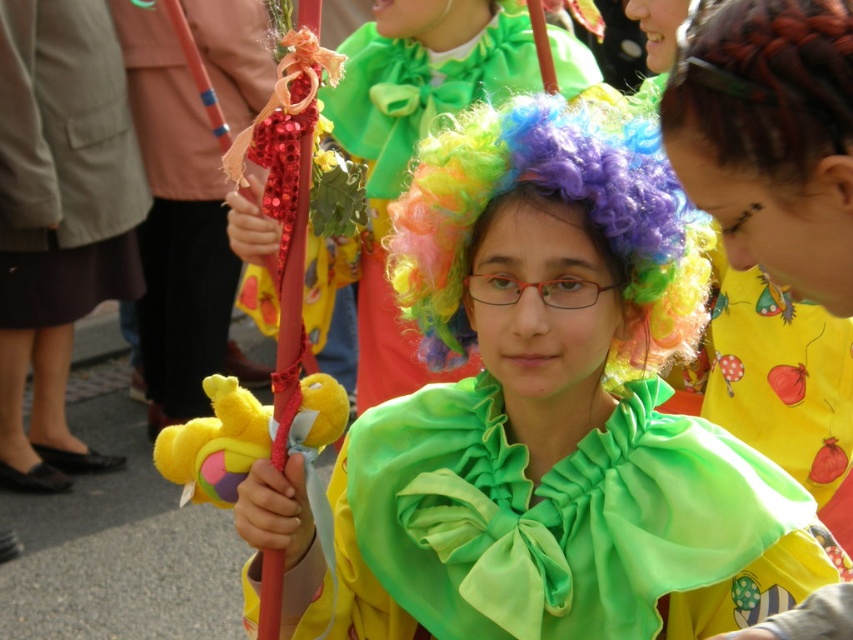
You are a photographer at the event and want to capture both the multicolored curly wig at center and the multicolored curly wig at upper right in a single shot. Which wig should you focus on first to ensure both are in frame?

The multicolored curly wig at upper right should be focused on first since it is smaller and positioned higher up, allowing the photographer to adjust the frame to include both wigs.

What are the coordinates of the green satin cape at center in the image?

The green satin cape at center is located at coordinates (563,525).